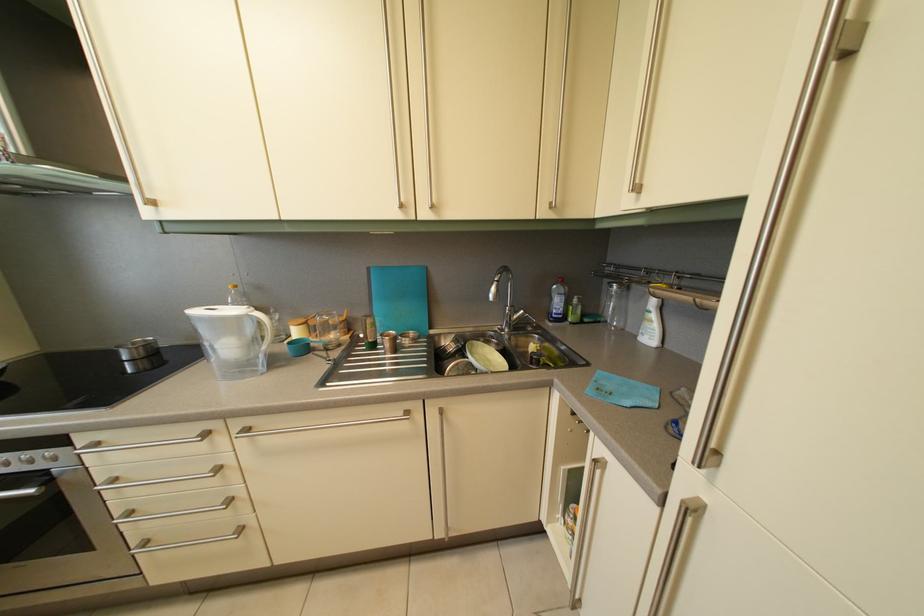
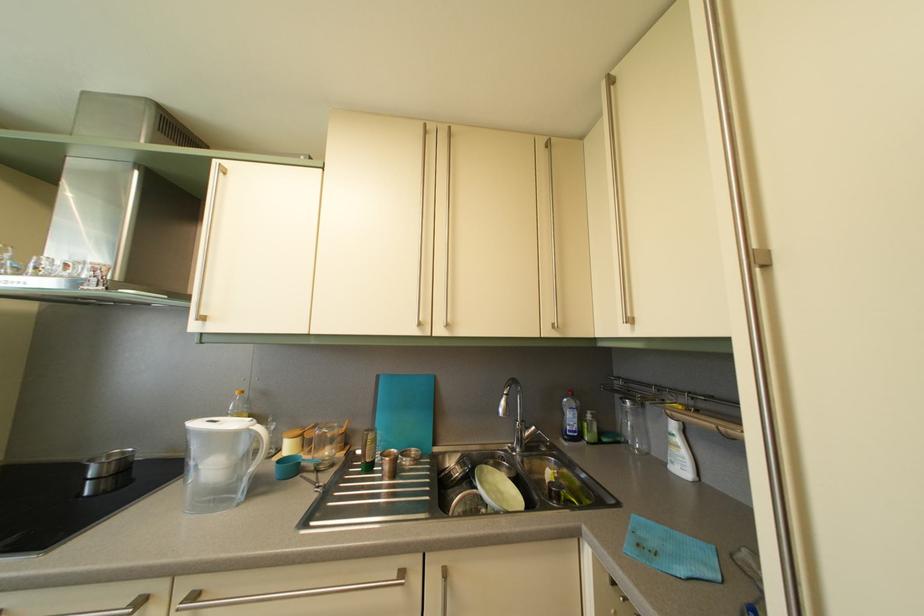
Find the pixel in the second image that matches point (142, 351) in the first image.

(118, 463)